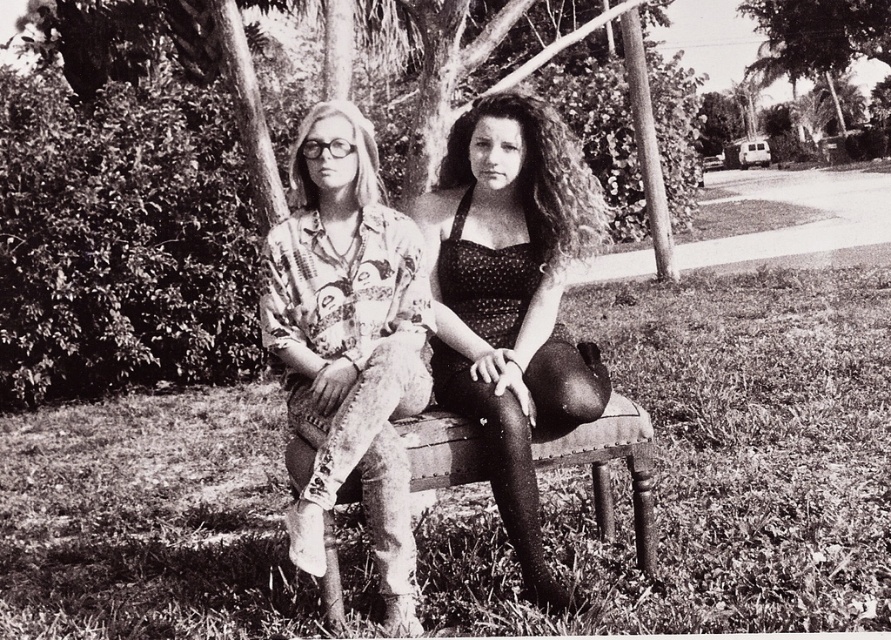
You are a fashion designer observing two garments in the image. The polka dot fabric dress at center and the printed fabric shirt at center. Which garment is positioned higher on the person?

The polka dot fabric dress at center is located above the printed fabric shirt at center, so the polka dot fabric dress at center is positioned higher.

You are a photographer trying to capture a detailed shot of the polka dot fabric dress at center and the smooth bark tree at upper right. Since you want to focus on the dress, which object should you move closer to in order to ensure it fills more of your camera frame?

The polka dot fabric dress at center is wider than the smooth bark tree at upper right, so moving closer to the polka dot fabric dress at center will make it fill more of the camera frame.

You are a photographer setting up a shot in the park. You notice the smooth bark tree trunk at center and the polka dot fabric dress at center. Which object should you focus on if you want to capture the larger subject in your frame?

The smooth bark tree trunk at center is larger in size than the polka dot fabric dress at center, so you should focus on the smooth bark tree trunk at center to capture the larger subject in your frame.